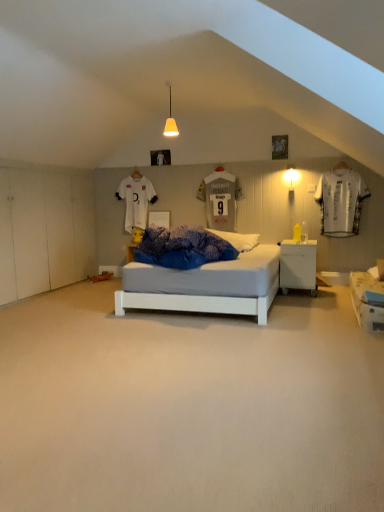
In order to face matte yellow cone at upper center, should I rotate leftwards or rightwards?

Rotate left and turn 2.615 degrees.

Where is `white glossy nightstand at center`? This screenshot has height=512, width=384. white glossy nightstand at center is located at coordinates (298, 265).

The width and height of the screenshot is (384, 512). In order to click on matte yellow cone at upper center in this screenshot , I will do `click(170, 122)`.

Is matte yellow cone at upper center positioned far away from white glossy nightstand at center?

Yes, matte yellow cone at upper center and white glossy nightstand at center are located far from each other.

In terms of height, does matte yellow cone at upper center look taller or shorter compared to white glossy nightstand at center?

matte yellow cone at upper center is shorter than white glossy nightstand at center.

In the scene shown: From the image's perspective, is matte yellow cone at upper center over white glossy nightstand at center?

Indeed, from the image's perspective, matte yellow cone at upper center is shown above white glossy nightstand at center.

Could you tell me if matte yellow cone at upper center is facing white glossy nightstand at center?

No, matte yellow cone at upper center is not facing towards white glossy nightstand at center.

Is white carpet at center bigger or smaller than matte yellow cone at upper center?

Considering their sizes, white carpet at center takes up more space than matte yellow cone at upper center.

How different are the orientations of white carpet at center and matte yellow cone at upper center in degrees?

There is a 2.12-degree angle between the facing directions of white carpet at center and matte yellow cone at upper center.

Which object is more forward, white carpet at center or matte yellow cone at upper center?

white carpet at center is closer to the camera.

Between white jersey at right and white carpet at center, which one has less height?

white carpet at center.

In terms of size, does white jersey at right appear bigger or smaller than white carpet at center?

Clearly, white jersey at right is smaller in size than white carpet at center.

Is point (334, 237) positioned in front of point (98, 407)?

That is False.

Is point (294, 262) farther from viewer compared to point (346, 174)?

No, it is not.

Where is `nightstand to the left of white jersey at right`? This screenshot has height=512, width=384. nightstand to the left of white jersey at right is located at coordinates (298, 265).

Are white glossy nightstand at center and white jersey at right far apart?

white glossy nightstand at center is far away from white jersey at right.

Considering the relative positions of white glossy nightstand at center and white jersey at right in the image provided, is white glossy nightstand at center to the left of white jersey at right from the viewer's perspective?

Yes.

From the image's perspective, which is above, white jersey at right or white glossy nightstand at center?

white jersey at right is shown above in the image.

The width and height of the screenshot is (384, 512). In order to click on laundry above the white glossy nightstand at center (from a real-world perspective) in this screenshot , I will do `click(340, 202)`.

Would you say white glossy nightstand at center is part of white jersey at right's contents?

No, white glossy nightstand at center is not a part of white jersey at right.

Considering the sizes of white carpet at center and white glossy nightstand at center in the image, is white carpet at center taller or shorter than white glossy nightstand at center?

Clearly, white carpet at center is shorter compared to white glossy nightstand at center.

From the image's perspective, is white carpet at center on white glossy nightstand at center?

Actually, white carpet at center appears below white glossy nightstand at center in the image.

From a real-world perspective, is white carpet at center on top of white glossy nightstand at center?

No, from a real-world perspective, white carpet at center is not over white glossy nightstand at center

Is white carpet at center oriented away from white glossy nightstand at center?

That's not correct — white carpet at center is not looking away from white glossy nightstand at center.

Which of these two, matte yellow cone at upper center or white carpet at center, is bigger?

With larger size is white carpet at center.

What's the angular difference between matte yellow cone at upper center and white carpet at center's facing directions?

2.12 degrees.

Looking at their sizes, would you say matte yellow cone at upper center is wider or thinner than white carpet at center?

Considering their sizes, matte yellow cone at upper center looks slimmer than white carpet at center.

From the image's perspective, would you say matte yellow cone at upper center is shown under white carpet at center?

No.

Locate an element on the screen. This screenshot has height=512, width=384. light fixture above the white glossy nightstand at center (from a real-world perspective) is located at coordinates (170, 122).

Locate an element on the screen. The image size is (384, 512). light fixture that is above the white carpet at center (from the image's perspective) is located at coordinates click(x=170, y=122).

Looking at the image, which one is located closer to white glossy nightstand at center, white carpet at center or white jersey at right?

white jersey at right lies closer to white glossy nightstand at center than the other object.

Considering their positions, is white jersey at right positioned closer to white carpet at center than white glossy nightstand at center?

The object closer to white carpet at center is white glossy nightstand at center.

Considering their positions, is white jersey at right positioned further to matte yellow cone at upper center than white carpet at center?

white carpet at center is further to matte yellow cone at upper center.

From the picture: Which object lies nearer to the anchor point white jersey at right, white carpet at center or matte yellow cone at upper center?

Based on the image, matte yellow cone at upper center appears to be nearer to white jersey at right.

Consider the image. Looking at the image, which one is located closer to white jersey at right, matte yellow cone at upper center or white carpet at center?

matte yellow cone at upper center is positioned closer to the anchor white jersey at right.

Looking at this image, from the image, which object appears to be nearer to white glossy nightstand at center, matte yellow cone at upper center or white jersey at right?

white jersey at right is positioned closer to the anchor white glossy nightstand at center.

From the image, which object appears to be nearer to matte yellow cone at upper center, white carpet at center or white jersey at right?

The object closer to matte yellow cone at upper center is white jersey at right.

Considering their positions, is white carpet at center positioned closer to matte yellow cone at upper center than white glossy nightstand at center?

white glossy nightstand at center lies closer to matte yellow cone at upper center than the other object.

Identify the location of light fixture located between white carpet at center and white glossy nightstand at center in the depth direction. (170, 122).

This screenshot has width=384, height=512. I want to click on nightstand between matte yellow cone at upper center and white jersey at right from left to right, so click(x=298, y=265).

Find the location of a particular element. This screenshot has height=512, width=384. nightstand positioned between white carpet at center and white jersey at right from near to far is located at coordinates (298, 265).

Where is `light fixture between white carpet at center and white jersey at right along the z-axis`? The image size is (384, 512). light fixture between white carpet at center and white jersey at right along the z-axis is located at coordinates (170, 122).